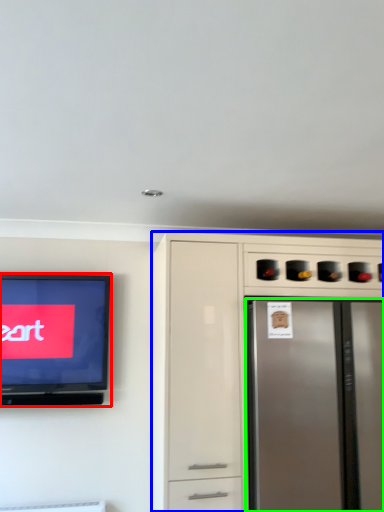
Question: Estimate the real-world distances between objects in this image. Which object is closer to television (highlighted by a red box), cabinetry (highlighted by a blue box) or refrigerator (highlighted by a green box)?

Choices:
 (A) cabinetry
 (B) refrigerator

Answer: (A)